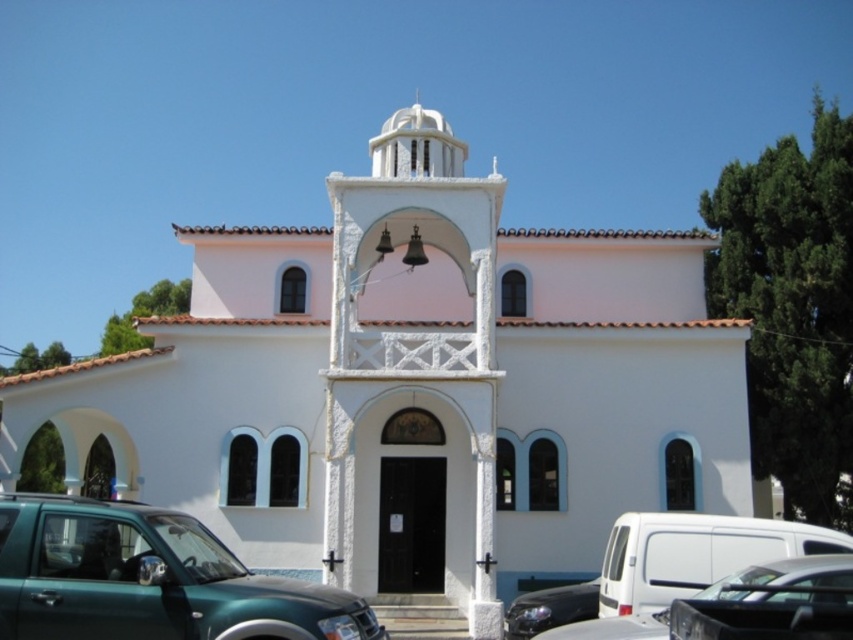
You are a photographer standing at the entrance of the white church building. You want to capture a photo of both the white stone bell tower at center and the green matte truck at lower left in the same frame. Which object should you focus on first to ensure both are in the frame?

The white stone bell tower at center is wider than the green matte truck at lower left, so you should focus on the white stone bell tower at center first to ensure both objects fit in the frame.

You are standing in front of the white church and want to take a photo of both the white stone bell tower at center and the black glossy car at lower right. Which object should you adjust your camera focus on first to ensure both are in the frame?

You should focus on the white stone bell tower at center first because it is closer to you than the black glossy car at lower right, so adjusting focus on it first ensures both are in the frame.

You are a photographer standing in front of the white church. You want to take a photo of the white stone bell tower at center and the black glossy car at lower right without any obstructions. Based on their positions, which object should you focus on first to ensure both are in the frame?

The white stone bell tower at center is positioned over the black glossy car at lower right, so you should focus on the black glossy car at lower right first to ensure both are visible in the frame.